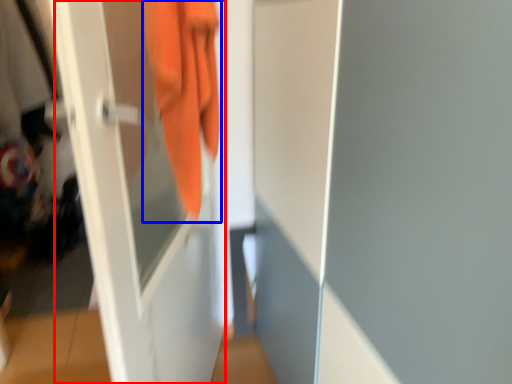
Question: Which point is further to the camera, screen door (highlighted by a red box) or towel (highlighted by a blue box)?

Choices:
 (A) screen door
 (B) towel

Answer: (B)